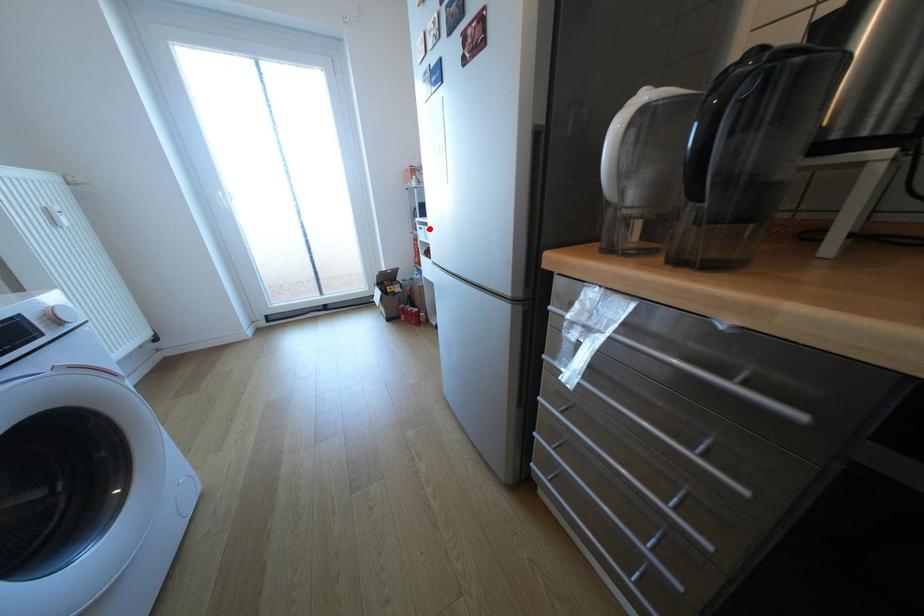
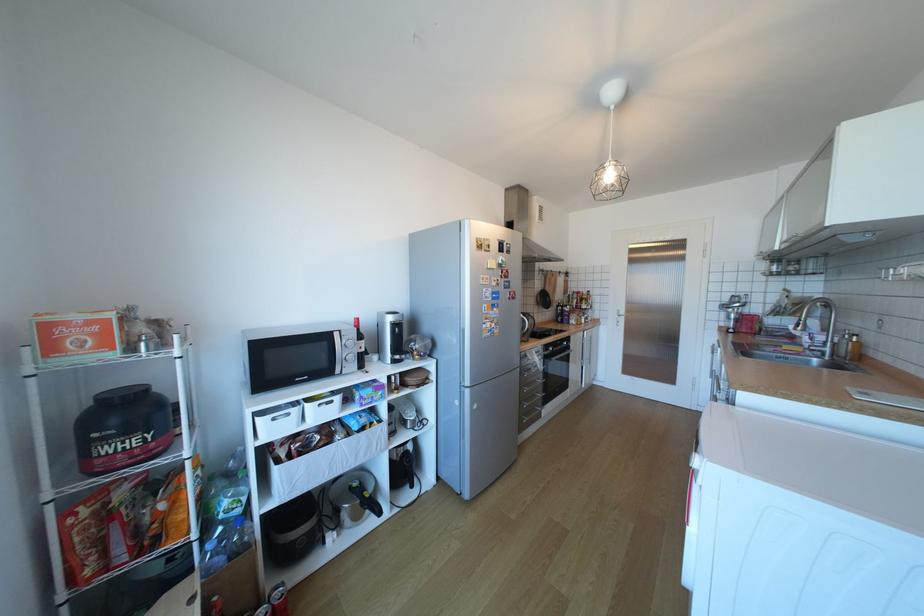
Question: I am providing you with two images of the same scene from different viewpoints. A red point is shown in image1. For the corresponding object point in image2, is it positioned nearer or farther from the camera?

Choices:
 (A) Nearer
 (B) Farther

Answer: (B)